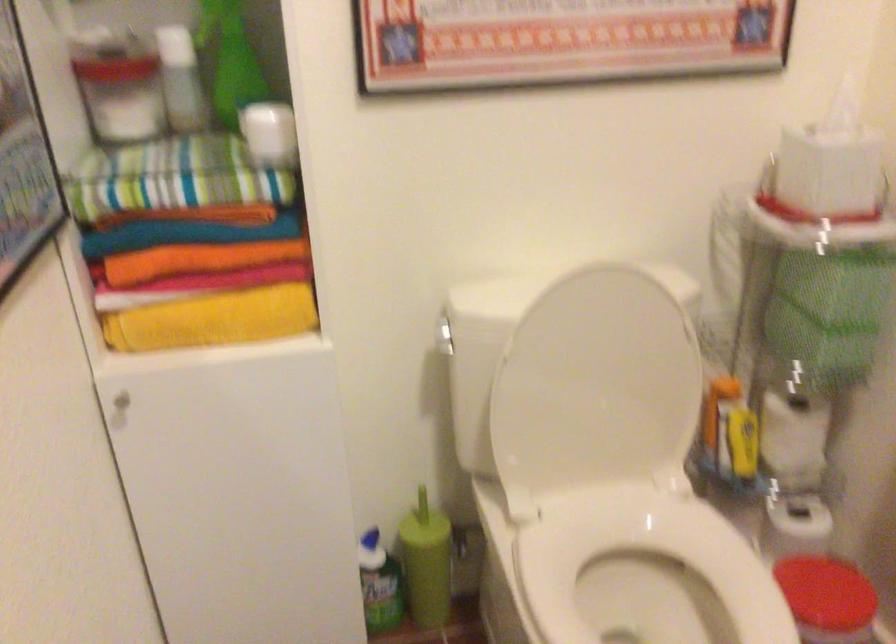
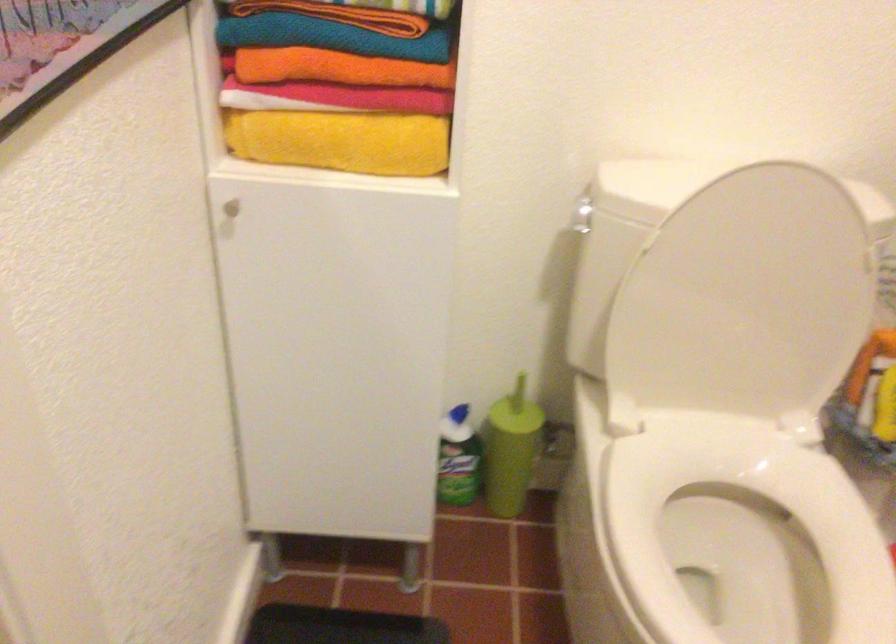
Question: The first image is from the beginning of the video and the second image is from the end. How did the camera likely rotate when shooting the video?

Choices:
 (A) Left
 (B) Right
 (C) Up
 (D) Down

Answer: (D)